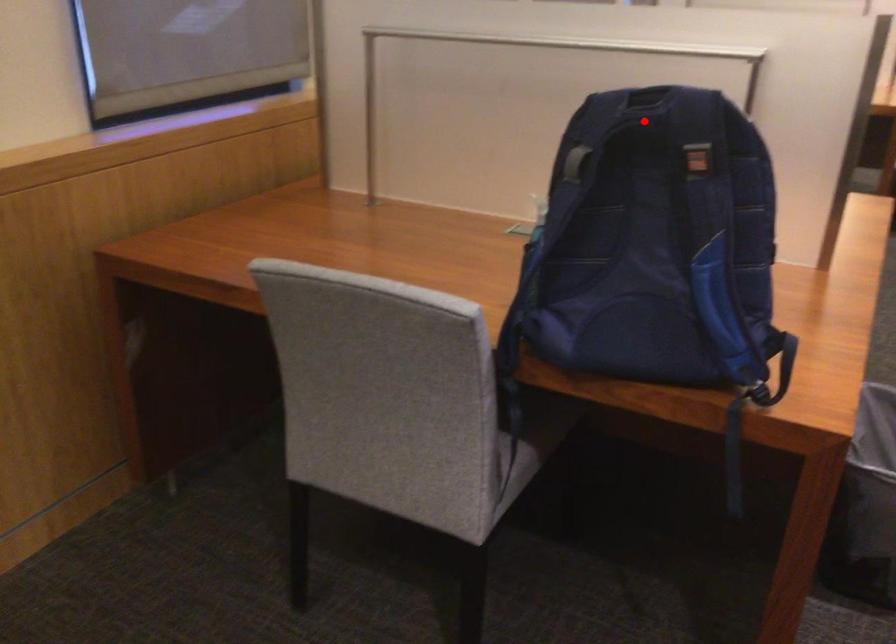
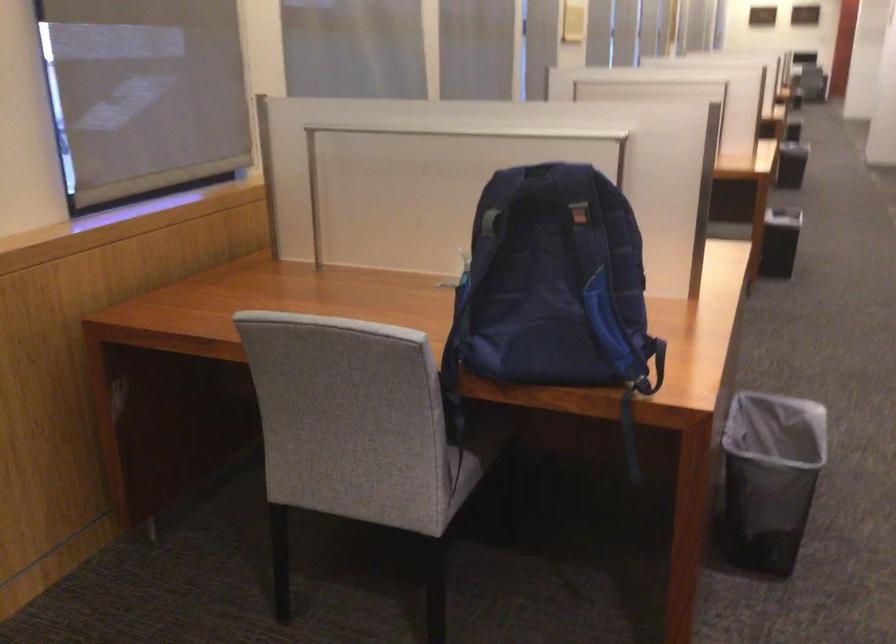
Question: A red point is marked in image1. In image2, is the corresponding 3D point closer to the camera or farther? Reply with the corresponding letter.

Choices:
 (A) The corresponding 3D point is closer.
 (B) The corresponding 3D point is farther.

Answer: (B)